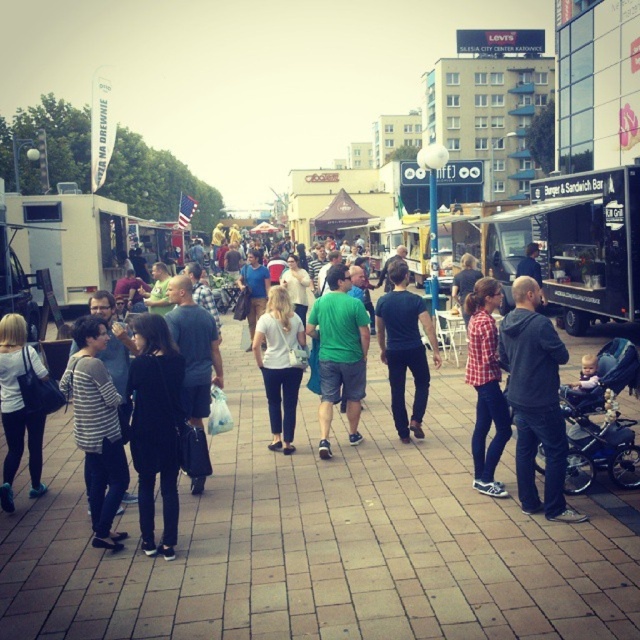
You are standing in the market and notice both the brick pavement at center and the matte gray shirt at center. Which object is positioned lower from the ground?

The brick pavement at center is located below matte gray shirt at center, so it is positioned lower from the ground.

From the picture: You are a photographer at the market and want to capture both the checkered fabric shirt at center and the matte black jacket at lower left in a single frame. Which subject should you position on the left side of your photo to ensure both are visible?

To capture both the checkered fabric shirt at center and the matte black jacket at lower left in a single frame, you should position the matte black jacket at lower left on the left side of your photo since the checkered fabric shirt at center is already to the right of it.